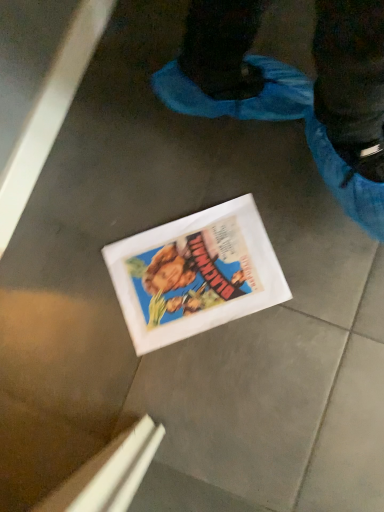
In order to face white paper flyer at center, should I rotate leftwards or rightwards?

A 0.375 degree turn to the right will do.

What do you see at coordinates (195, 274) in the screenshot? I see `white paper flyer at center` at bounding box center [195, 274].

Image resolution: width=384 pixels, height=512 pixels. I want to click on white paper flyer at center, so click(x=195, y=274).

Locate an element on the screen. The image size is (384, 512). white paper flyer at center is located at coordinates (195, 274).